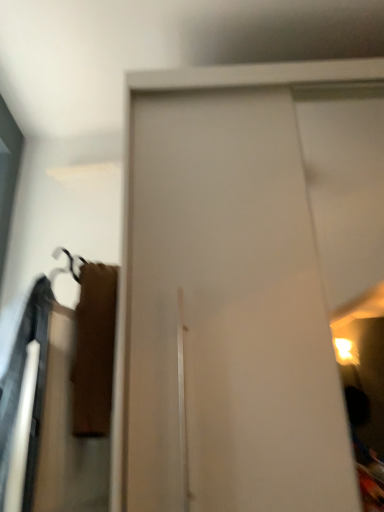
What is the approximate width of white glossy door at center?

The width of white glossy door at center is 26.49 inches.

Describe the element at coordinates (228, 313) in the screenshot. I see `white glossy door at center` at that location.

Find the location of a particular element. The height and width of the screenshot is (512, 384). white glossy door at center is located at coordinates (228, 313).

What are the coordinates of `velvet brown robe at left` in the screenshot? It's located at (20, 387).

The width and height of the screenshot is (384, 512). Describe the element at coordinates (20, 387) in the screenshot. I see `velvet brown robe at left` at that location.

You are a GUI agent. You are given a task and a screenshot of the screen. Output one action in this format:
    pyautogui.click(x=<x>, y=<y>)
    Task: Click on the white glossy door at center
    This screenshot has width=384, height=512.
    Given the screenshot: What is the action you would take?
    pyautogui.click(x=228, y=313)

Visually, is white glossy door at center positioned to the left or to the right of velvet brown robe at left?

Based on their positions, white glossy door at center is located to the right of velvet brown robe at left.

Which is in front, white glossy door at center or velvet brown robe at left?

white glossy door at center is closer to the camera.

Considering the points (278, 287) and (39, 423), which point is behind, point (278, 287) or point (39, 423)?

The point (278, 287) is behind.

From the image's perspective, does white glossy door at center appear lower than velvet brown robe at left?

No.

From a real-world perspective, is white glossy door at center physically above velvet brown robe at left?

Yes.

Considering the sizes of white glossy door at center and velvet brown robe at left in the image, is white glossy door at center wider or thinner than velvet brown robe at left?

In the image, white glossy door at center appears to be wider than velvet brown robe at left.

Which of these two, white glossy door at center or velvet brown robe at left, stands taller?

white glossy door at center is taller.

Which of these two, white glossy door at center or velvet brown robe at left, is bigger?

With larger size is white glossy door at center.

Do you think white glossy door at center is within velvet brown robe at left, or outside of it?

white glossy door at center is not inside velvet brown robe at left, it's outside.

Is the surface of white glossy door at center in direct contact with velvet brown robe at left?

There is a gap between white glossy door at center and velvet brown robe at left.

Is white glossy door at center aimed at velvet brown robe at left?

No, white glossy door at center is not facing towards velvet brown robe at left.

What's the angular difference between white glossy door at center and velvet brown robe at left's facing directions?

The angle between the facing direction of white glossy door at center and the facing direction of velvet brown robe at left is 22.2 degrees.

Measure the distance from white glossy door at center to velvet brown robe at left.

They are 17.74 inches apart.

The width and height of the screenshot is (384, 512). In the image, there is a white glossy door at center. Find the location of `robe below it (from a real-world perspective)`. robe below it (from a real-world perspective) is located at coordinates coord(20,387).

Is velvet brown robe at left to the left of white glossy door at center from the viewer's perspective?

Yes.

Is velvet brown robe at left in front of or behind white glossy door at center in the image?

Visually, velvet brown robe at left is located behind white glossy door at center.

Is point (10, 411) farther from viewer compared to point (207, 118)?

That is False.

Looking at this image, from the image's perspective, does velvet brown robe at left appear higher than white glossy door at center?

No, from the image's perspective, velvet brown robe at left is not on top of white glossy door at center.

From a real-world perspective, is velvet brown robe at left positioned under white glossy door at center based on gravity?

Yes, from a real-world perspective, velvet brown robe at left is beneath white glossy door at center.

Considering the sizes of velvet brown robe at left and white glossy door at center in the image, is velvet brown robe at left wider or thinner than white glossy door at center?

Considering their sizes, velvet brown robe at left looks slimmer than white glossy door at center.

Can you confirm if velvet brown robe at left is shorter than white glossy door at center?

Indeed, velvet brown robe at left has a lesser height compared to white glossy door at center.

Between velvet brown robe at left and white glossy door at center, which one has smaller size?

With smaller size is velvet brown robe at left.

Is velvet brown robe at left outside of white glossy door at center?

velvet brown robe at left is positioned outside white glossy door at center.

Would you consider velvet brown robe at left to be distant from white glossy door at center?

No, there isn't a large distance between velvet brown robe at left and white glossy door at center.

Is velvet brown robe at left oriented away from white glossy door at center?

No.

Can you tell me how much velvet brown robe at left and white glossy door at center differ in facing direction?

velvet brown robe at left and white glossy door at center are facing 22.2 degrees away from each other.

How far apart are velvet brown robe at left and white glossy door at center?

velvet brown robe at left and white glossy door at center are 17.74 inches apart from each other.

Where is `screen door in front of the velvet brown robe at left`? Image resolution: width=384 pixels, height=512 pixels. screen door in front of the velvet brown robe at left is located at coordinates (228, 313).

Find the location of a particular element. The width and height of the screenshot is (384, 512). robe that appears behind the white glossy door at center is located at coordinates pos(20,387).

The height and width of the screenshot is (512, 384). I want to click on screen door on the right side of velvet brown robe at left, so click(228, 313).